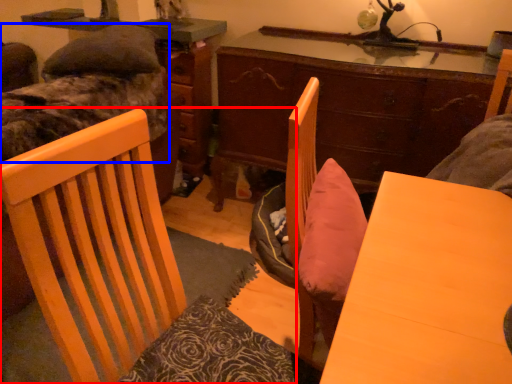
Question: Which object is closer to the camera taking this photo, chair (highlighted by a red box) or bed (highlighted by a blue box)?

Choices:
 (A) chair
 (B) bed

Answer: (A)